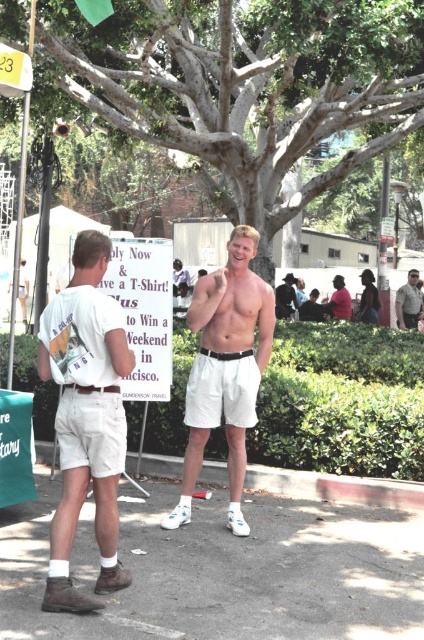
You are at a community event and see two people standing at the center. The first person is wearing white cotton shorts at center and the second is wearing a matte pink shirt at center. Which clothing item is more to the left?

The white cotton shorts at center is more to the left side of the matte pink shirt at center.

You are a photographer setting up for a group photo at this event. You want to ensure both the white cotton shorts at center and the matte pink shirt at center are in focus. Given that your camera has a depth of field range of 20 feet, will both subjects be in focus?

The white cotton shorts at center and matte pink shirt at center are 30.65 feet apart. Since the camera has a depth of field range of 20 feet, which is less than the distance between them, not both subjects will be in focus simultaneously.

You are organizing a community event and need to arrange seating. You have a chair that needs to be placed under the shiny black jacket at upper center. Can the chair be placed there without blocking the view of the white cotton shorts at center?

The white cotton shorts at center is positioned under the shiny black jacket at upper center, so placing a chair under the shiny black jacket at upper center would block the view of the white cotton shorts at center.